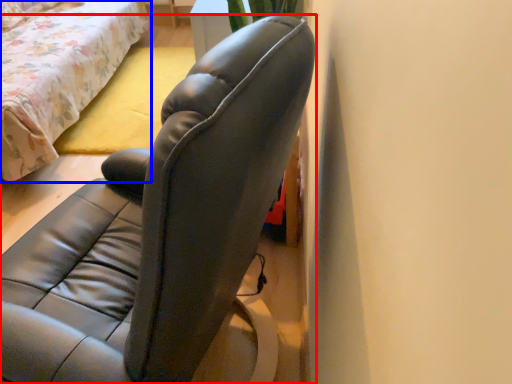
Question: Among these objects, which one is farthest to the camera, chair (highlighted by a red box) or bed (highlighted by a blue box)?

Choices:
 (A) chair
 (B) bed

Answer: (B)